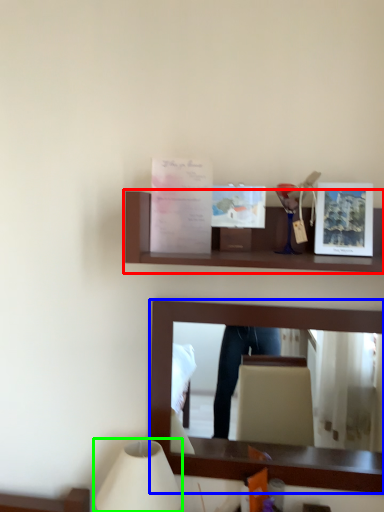
Question: Considering the real-world distances, which object is farthest from shelf (highlighted by a red box)? mirror (highlighted by a blue box) or table lamp (highlighted by a green box)?

Choices:
 (A) mirror
 (B) table lamp

Answer: (B)